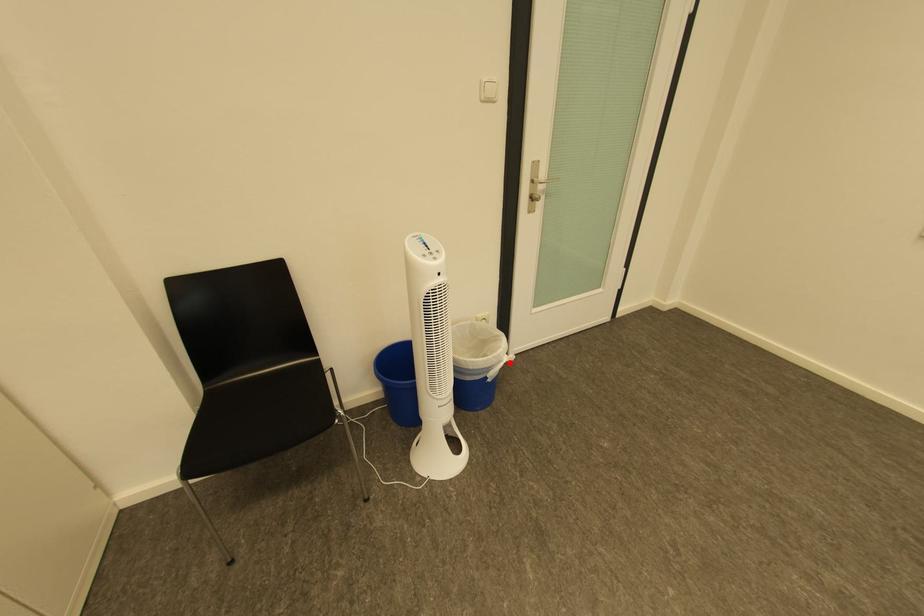
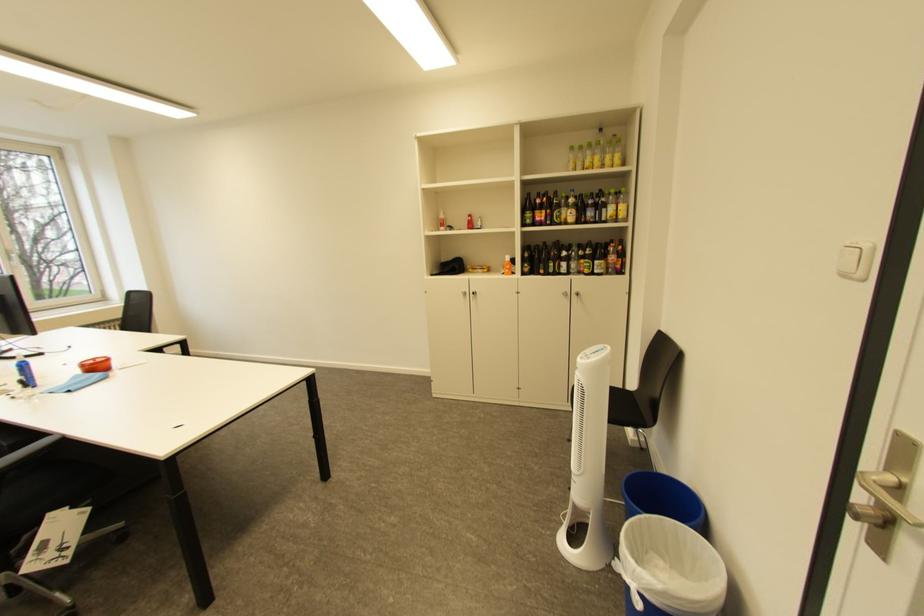
Where in the second image is the point corresponding to the highlighted location from the first image?

(636, 570)